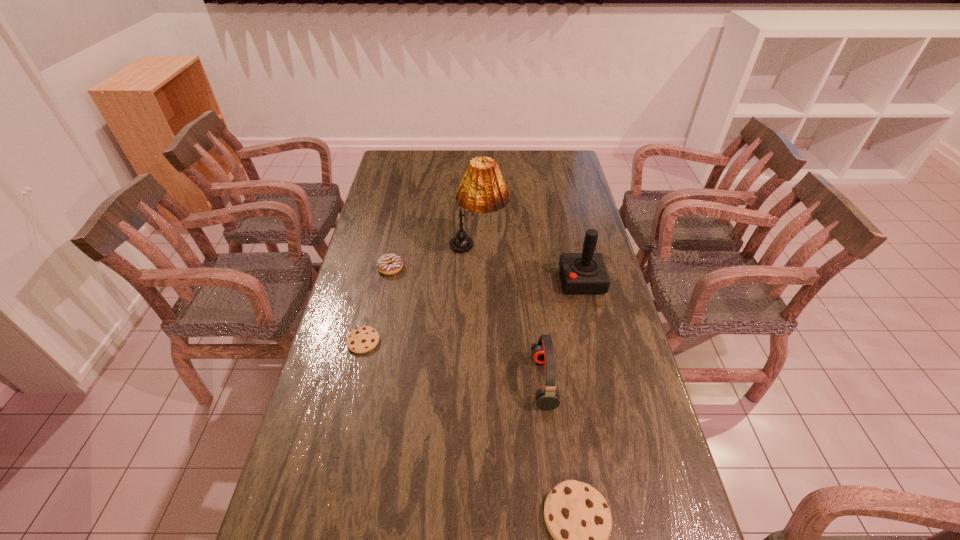
This screenshot has width=960, height=540. Identify the location of vacant space at the near edge of the desktop. (420, 529).

Identify the location of vacant space at the left edge of the desktop. This screenshot has width=960, height=540. (374, 232).

The height and width of the screenshot is (540, 960). Identify the location of vacant region at the right edge of the desktop. (584, 203).

The width and height of the screenshot is (960, 540). I want to click on free region at the far left corner of the desktop, so click(414, 173).

What are the coordinates of `free space between the fourth object from right to left and the second tallest object` in the screenshot? It's located at coord(530,265).

This screenshot has width=960, height=540. Find the location of `free space between the farther cookie and the tallest object`. free space between the farther cookie and the tallest object is located at coordinates (420, 295).

You are a GUI agent. You are given a task and a screenshot of the screen. Output one action in this format:
    pyautogui.click(x=<x>, y=<y>)
    Task: Click on the vacant space that is in between the farther cookie and the joystick
    
    Given the screenshot: What is the action you would take?
    pyautogui.click(x=472, y=311)

Where is `vacant space that is in between the earphone and the fifth shortest object`? vacant space that is in between the earphone and the fifth shortest object is located at coordinates pyautogui.click(x=563, y=330).

Identify the location of free spot between the farther cookie and the earphone. This screenshot has width=960, height=540. (453, 361).

Find the location of a particular element. The height and width of the screenshot is (540, 960). vacant space that's between the fifth shortest object and the left cookie is located at coordinates (472, 311).